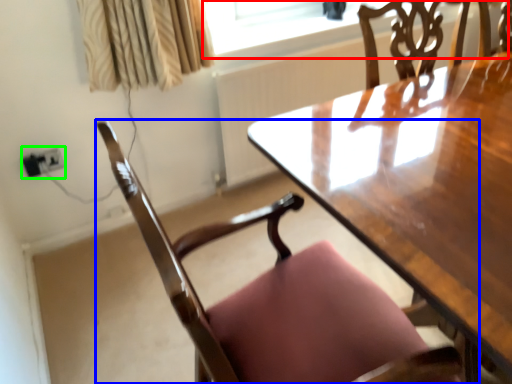
Question: Which object is positioned farthest from window screen (highlighted by a red box)? Select from chair (highlighted by a blue box) and electric outlet (highlighted by a green box).

Choices:
 (A) chair
 (B) electric outlet

Answer: (A)